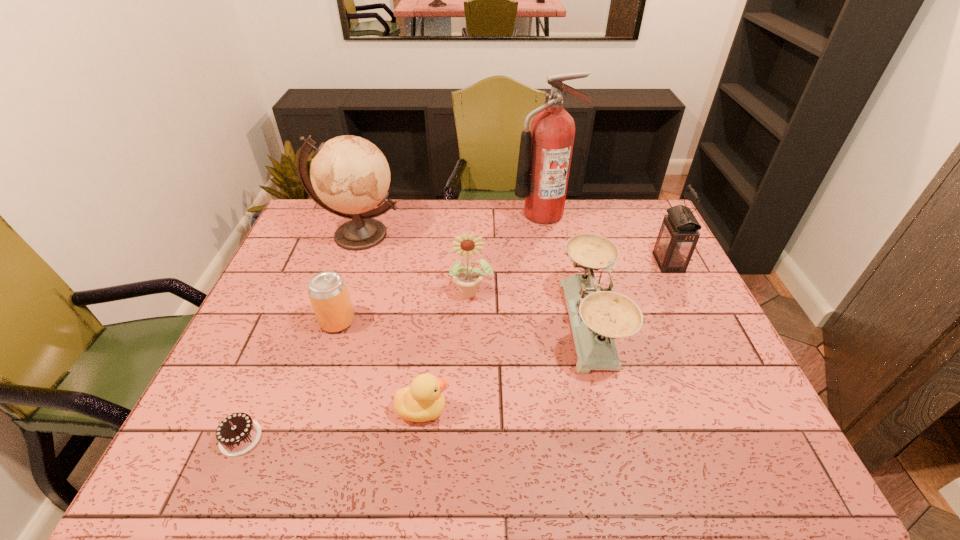
This screenshot has width=960, height=540. What are the coordinates of `free space at the right edge of the desktop` in the screenshot? It's located at (722, 345).

Locate an element on the screen. Image resolution: width=960 pixels, height=540 pixels. free space at the far left corner of the desktop is located at coordinates (328, 215).

Locate an element on the screen. This screenshot has height=540, width=960. vacant space at the far right corner of the desktop is located at coordinates (625, 208).

Where is `vacant region between the fire extinguisher and the sunflower`? vacant region between the fire extinguisher and the sunflower is located at coordinates (507, 253).

Where is `vacant area between the chocolate cake and the seventh shortest object`? The image size is (960, 540). vacant area between the chocolate cake and the seventh shortest object is located at coordinates (300, 336).

The height and width of the screenshot is (540, 960). I want to click on free space between the sunflower and the shortest object, so click(356, 365).

This screenshot has width=960, height=540. Find the location of `free spot between the seventh tallest object and the scale`. free spot between the seventh tallest object and the scale is located at coordinates (506, 367).

I want to click on empty space between the sunflower and the pop (soda), so click(x=404, y=307).

Find the location of a particular element. free space between the seventh shortest object and the sunflower is located at coordinates (416, 264).

The width and height of the screenshot is (960, 540). Identify the location of free space between the sunflower and the second shortest object. pos(446,351).